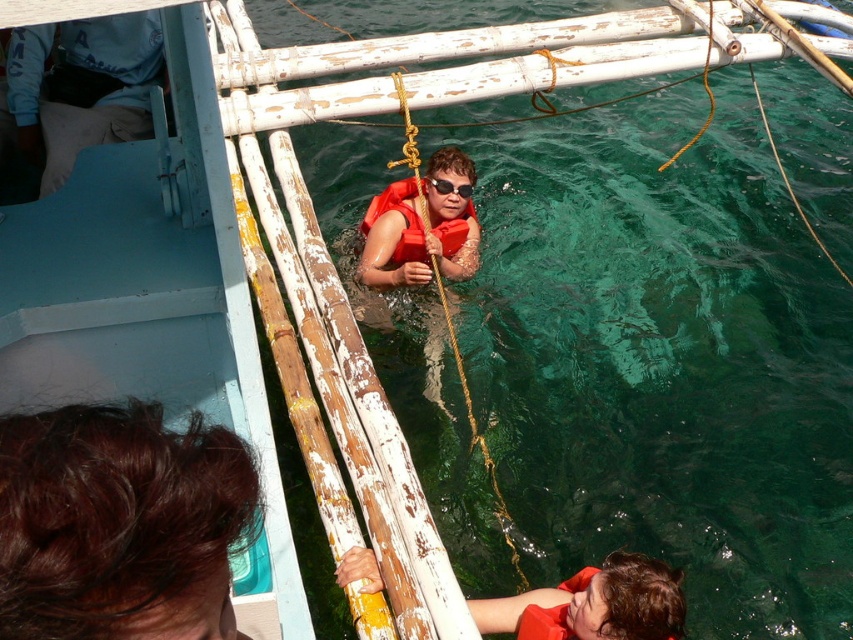
You are a lifeguard on duty and notice two people in the water near the boat. One is climbing up using a rope tied to the boat, and the other is at point (119, 524). Based on their positions, which person is closer to the boat?

The person climbing up using a rope tied to the boat is closer to the boat than the dark brown hair at lower left located at point (119, 524).

You are a safety inspector reviewing the image of the boat scene. You notice the matte orange life vest at lower center and the black plastic goggles at center. According to safety regulations, life vests must be positioned above goggles to ensure quick access. Is the current arrangement compliant?

The matte orange life vest at lower center is below the black plastic goggles at center, which violates safety regulations requiring life vests to be positioned above goggles for quick access.

You are navigating a small boat and need to determine the order of two points on your map based on their positions relative to your current location. The points are labeled as point 1 at coordinates point [405,188] and point 2 at coordinates point [431,180]. According to the scene, which point is closer to your current position?

Point [431,180] is closer to your current position because point [405,188] is behind it.